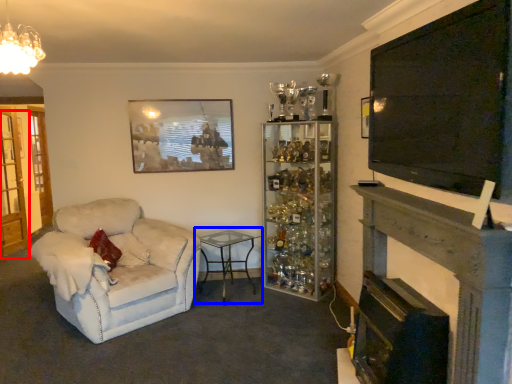
Question: Which point is closer to the camera, glass door (highlighted by a red box) or table (highlighted by a blue box)?

Choices:
 (A) glass door
 (B) table

Answer: (B)